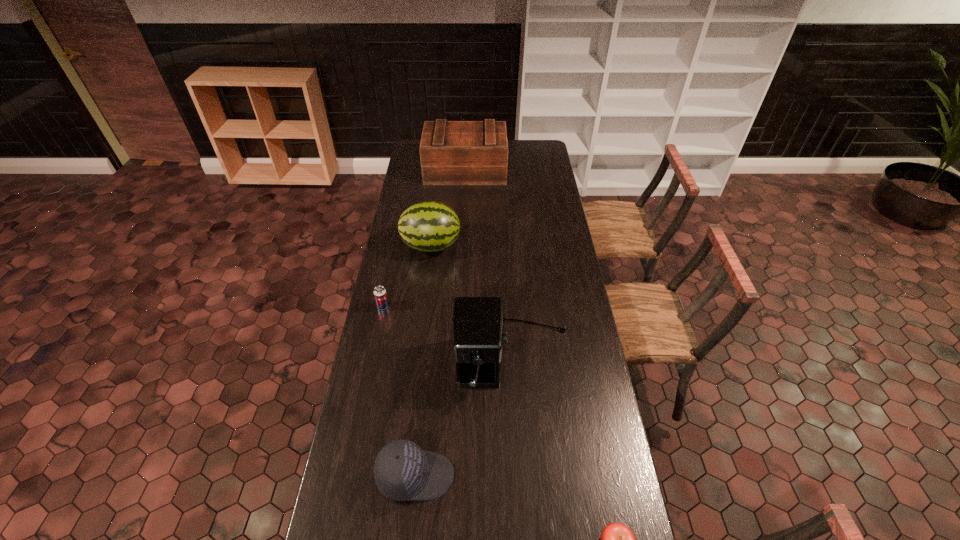
I want to click on blank area located 0.330m at the front of the baseball cap where the brim is located, so click(x=564, y=476).

The height and width of the screenshot is (540, 960). What are the coordinates of `vacant space located 0.120m on the back of the beer can` in the screenshot? It's located at (388, 281).

I want to click on object positioned at the far edge, so click(451, 152).

The width and height of the screenshot is (960, 540). Find the location of `box at the left edge`. box at the left edge is located at coordinates (451, 152).

Where is `watermelon situated at the left edge`? The height and width of the screenshot is (540, 960). watermelon situated at the left edge is located at coordinates (429, 226).

At what (x,y) coordinates should I click in order to perform the action: click on baseball cap at the left edge. Please return your answer as a coordinate pair (x, y). This screenshot has height=540, width=960. Looking at the image, I should click on (403, 471).

Image resolution: width=960 pixels, height=540 pixels. What are the coordinates of `beer can that is at the left edge` in the screenshot? It's located at (380, 294).

What are the coordinates of `object situated at the right edge` in the screenshot? It's located at click(x=478, y=322).

I want to click on object located in the far left corner section of the desktop, so click(451, 152).

Find the location of a particular element. The height and width of the screenshot is (540, 960). free region at the left edge is located at coordinates (417, 254).